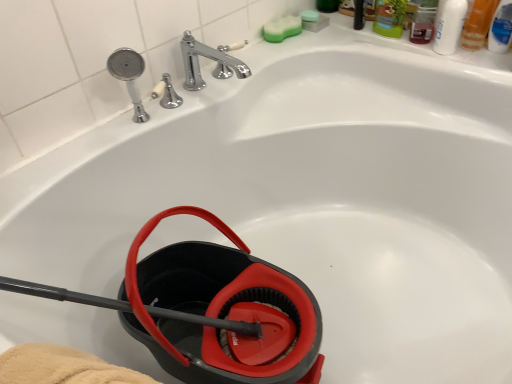
Locate an element on the screen. This screenshot has height=384, width=512. vacant space in front of translucent plastic mouthwash at upper right, the second mouthwash when ordered from left to right is located at coordinates (485, 59).